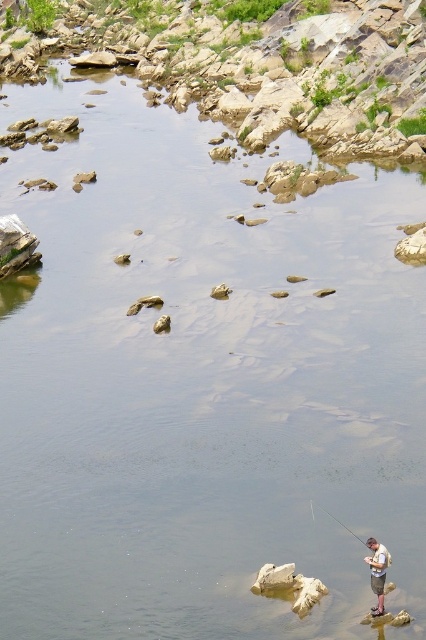
Identify the location of khaki shorts at lower right. The image size is (426, 640). (377, 572).

Is point (382, 547) farther from viewer compared to point (330, 516)?

No, it is in front of (330, 516).

Locate an element on the screen. Image resolution: width=426 pixels, height=640 pixels. khaki shorts at lower right is located at coordinates (377, 572).